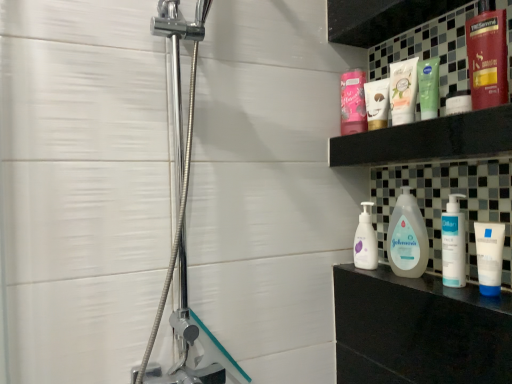
Question: Considering the positions of white matte pump bottle at right, positioned as the 1th cleaning product in back-to-front order, and green matte lotion at upper center, the 3th toiletry when ordered from back to front, in the image, is white matte pump bottle at right, positioned as the 1th cleaning product in back-to-front order, wider or thinner than green matte lotion at upper center, the 3th toiletry when ordered from back to front,?

Choices:
 (A) wide
 (B) thin

Answer: (A)

Question: In terms of size, does white matte pump bottle at right, positioned as the 1th cleaning product in back-to-front order, appear bigger or smaller than green matte lotion at upper center, the 3th toiletry when ordered from back to front?

Choices:
 (A) small
 (B) big

Answer: (B)

Question: Estimate the real-world distances between objects in this image. Which object is farther from the pink matte jar at upper center, which is the first toiletry in back-to-front order?

Choices:
 (A) matte pink lotion at upper center, the 5th toiletry in the front-to-back sequence
 (B) white matte pump bottle at right, which appears as the second cleaning product when viewed from the front
 (C) shiny red hair conditioner at upper right, which is counted as the 6th toiletry, starting from the back
 (D) white matte toothpaste at upper center
 (E) white glossy johnson's baby lotion at center, the first cleaning product when ordered from front to back

Answer: (C)

Question: Estimate the real-world distances between objects in this image. Which object is closer to the white matte toothpaste at upper center?

Choices:
 (A) shiny red hair conditioner at upper right, which is counted as the 6th toiletry, starting from the back
 (B) white matte pump bottle at right, which appears as the second cleaning product when viewed from the front
 (C) pink matte jar at upper center, the 6th toiletry positioned from the front
 (D) green matte lotion at upper center, the 3th toiletry when ordered from back to front
 (E) white matte tube at right, arranged as the fifth toiletry when viewed from the back

Answer: (D)